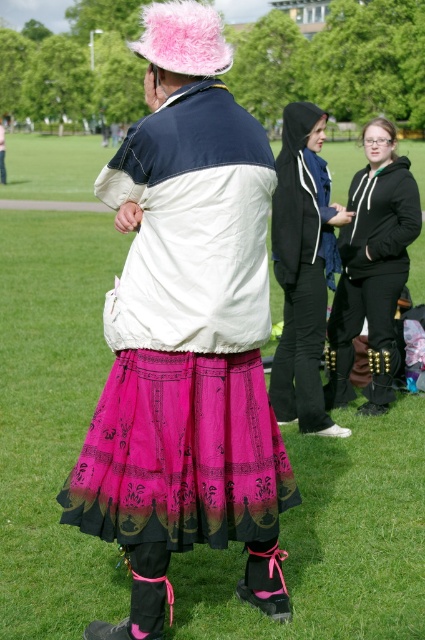
Is black hoodie at center below black leather boots at right?

Yes, black hoodie at center is below black leather boots at right.

Can you confirm if black hoodie at center is taller than black leather boots at right?

Yes, black hoodie at center is taller than black leather boots at right.

Identify the location of black hoodie at center. Image resolution: width=425 pixels, height=640 pixels. (303, 268).

Locate an element on the screen. black hoodie at center is located at coordinates (303, 268).

Is pink sheer skirt at center bigger than black leather boots at right?

Yes.

The image size is (425, 640). What are the coordinates of `pink sheer skirt at center` in the screenshot? It's located at (187, 339).

Is black leather boots at right above pink feathered hat at upper center?

Actually, black leather boots at right is below pink feathered hat at upper center.

In order to click on black leather boots at right in this screenshot , I will do `click(373, 268)`.

Where is `black leather boots at right`? This screenshot has height=640, width=425. black leather boots at right is located at coordinates (373, 268).